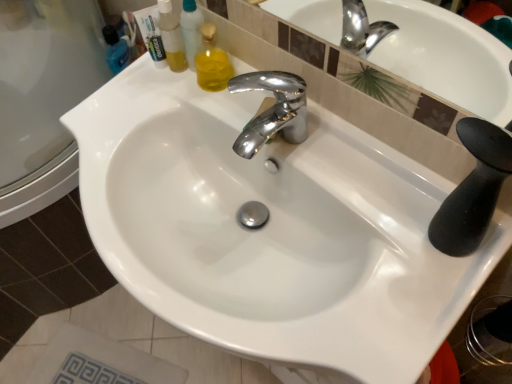
Question: Should I look upward or downward to see chrome metallic faucet at center?

Choices:
 (A) down
 (B) up

Answer: (B)

Question: From the image's perspective, is chrome metallic faucet at center beneath translucent plastic bottle at upper left?

Choices:
 (A) yes
 (B) no

Answer: (A)

Question: Is chrome metallic faucet at center positioned in front of translucent plastic bottle at upper left?

Choices:
 (A) no
 (B) yes

Answer: (B)

Question: Can translucent plastic bottle at upper left be found inside chrome metallic faucet at center?

Choices:
 (A) yes
 (B) no

Answer: (B)

Question: Is chrome metallic faucet at center at the right side of translucent plastic bottle at upper left?

Choices:
 (A) yes
 (B) no

Answer: (A)

Question: Considering the relative sizes of chrome metallic faucet at center and translucent plastic bottle at upper left in the image provided, is chrome metallic faucet at center bigger than translucent plastic bottle at upper left?

Choices:
 (A) yes
 (B) no

Answer: (B)

Question: Is chrome metallic faucet at center not within translucent plastic bottle at upper left?

Choices:
 (A) yes
 (B) no

Answer: (A)

Question: Is translucent plastic bottle at upper left directly adjacent to chrome metallic faucet at center?

Choices:
 (A) no
 (B) yes

Answer: (A)

Question: Can you confirm if translucent plastic bottle at upper left is smaller than chrome metallic faucet at center?

Choices:
 (A) no
 (B) yes

Answer: (A)

Question: Is translucent plastic bottle at upper left wider than chrome metallic faucet at center?

Choices:
 (A) yes
 (B) no

Answer: (B)

Question: Is the depth of translucent plastic bottle at upper left greater than that of chrome metallic faucet at center?

Choices:
 (A) no
 (B) yes

Answer: (B)

Question: From a real-world perspective, is translucent plastic bottle at upper left physically above chrome metallic faucet at center?

Choices:
 (A) yes
 (B) no

Answer: (A)

Question: From the image's perspective, does translucent plastic bottle at upper left appear higher than chrome metallic faucet at center?

Choices:
 (A) yes
 (B) no

Answer: (A)

Question: Is chrome metallic faucet at center in front of or behind translucent plastic bottle at upper left in the image?

Choices:
 (A) behind
 (B) front

Answer: (B)